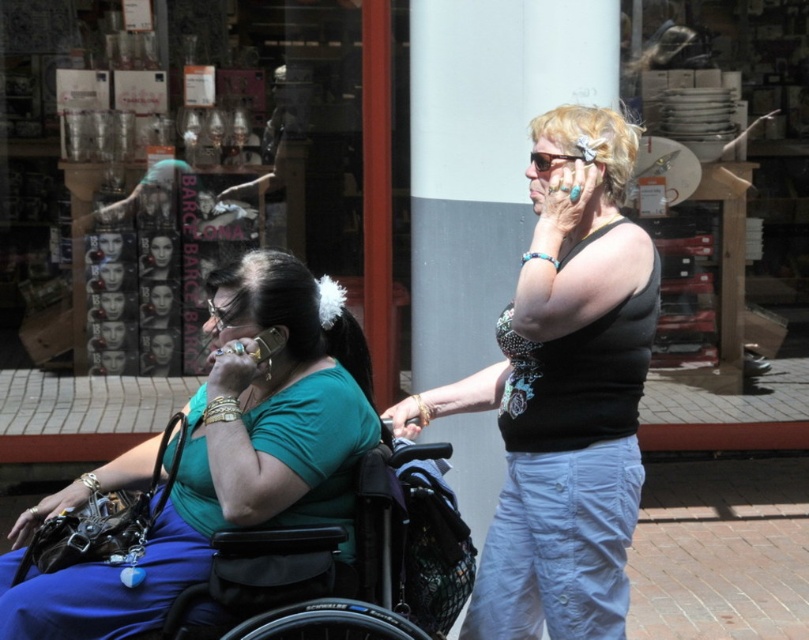
Question: Which object appears closest to the camera in this image?

Choices:
 (A) green matte shirt at center
 (B) transparent glass display at center
 (C) black metallic wheelchair at center
 (D) black dotted tank top at center

Answer: (A)

Question: Does black dotted tank top at center appear under black metallic wheelchair at center?

Choices:
 (A) yes
 (B) no

Answer: (B)

Question: Can you confirm if black dotted tank top at center is thinner than black metallic wheelchair at center?

Choices:
 (A) no
 (B) yes

Answer: (B)

Question: Can you confirm if green matte shirt at center is smaller than black metallic wheelchair at center?

Choices:
 (A) yes
 (B) no

Answer: (B)

Question: Which of the following is the farthest from the observer?

Choices:
 (A) green matte shirt at center
 (B) black dotted tank top at center
 (C) transparent glass display at center
 (D) black metallic wheelchair at center

Answer: (C)

Question: Which point is closer to the camera?

Choices:
 (A) transparent glass display at center
 (B) black metallic wheelchair at center
 (C) green matte shirt at center
 (D) black dotted tank top at center

Answer: (C)